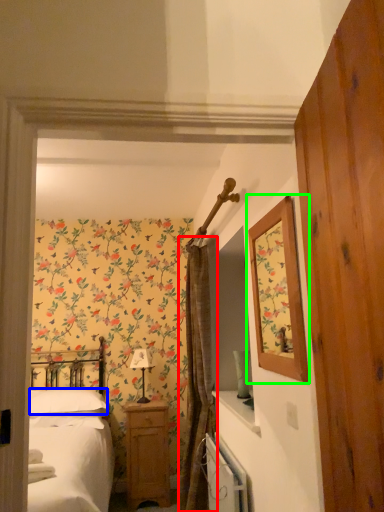
Question: Considering the real-world distances, which object is closest to curtain (highlighted by a red box)? pillow (highlighted by a blue box) or picture frame (highlighted by a green box).

Choices:
 (A) pillow
 (B) picture frame

Answer: (A)